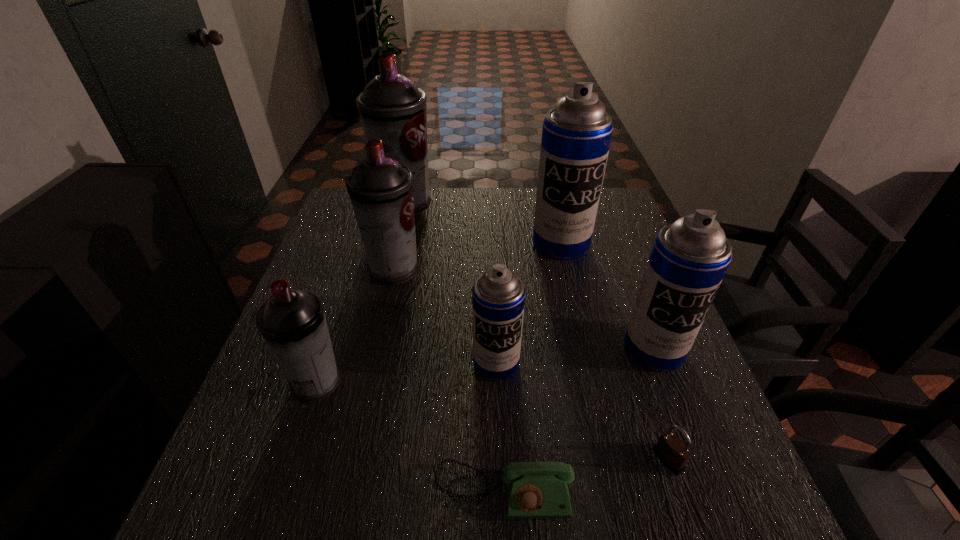
At what (x,y) coordinates should I click in order to perform the action: click on the seventh tallest object. Please return your answer as a coordinate pair (x, y). This screenshot has height=540, width=960. Looking at the image, I should click on (671, 451).

At what (x,y) coordinates should I click in order to perform the action: click on the shortest object. Please return your answer as a coordinate pair (x, y). Looking at the image, I should click on (534, 490).

Locate an element on the screen. This screenshot has height=540, width=960. vacant region located 0.110m on the right of the farthest gray aerosol can is located at coordinates (468, 204).

This screenshot has height=540, width=960. Find the location of `free space located on the label side of the second blue aerosol can from right to left`. free space located on the label side of the second blue aerosol can from right to left is located at coordinates (586, 353).

You are a GUI agent. You are given a task and a screenshot of the screen. Output one action in this format:
    pyautogui.click(x=<x>, y=<y>)
    Task: Click on the free space located 0.250m on the back of the second biggest gray aerosol can
    This screenshot has height=540, width=960.
    Given the screenshot: What is the action you would take?
    pyautogui.click(x=408, y=205)

Find the location of `free space located 0.130m on the label side of the rightmost aerosol can`. free space located 0.130m on the label side of the rightmost aerosol can is located at coordinates (684, 429).

Image resolution: width=960 pixels, height=540 pixels. In order to click on free space located on the label side of the smallest blue aerosol can in this screenshot , I will do `click(502, 536)`.

This screenshot has width=960, height=540. In order to click on vacant space located 0.060m on the left of the nearest gray aerosol can in this screenshot , I will do `click(259, 382)`.

The width and height of the screenshot is (960, 540). What are the coordinates of `blank space located 0.090m on the back of the padlock` in the screenshot? It's located at (648, 401).

Where is `object positioned at the near edge`? The width and height of the screenshot is (960, 540). object positioned at the near edge is located at coordinates pos(534,490).